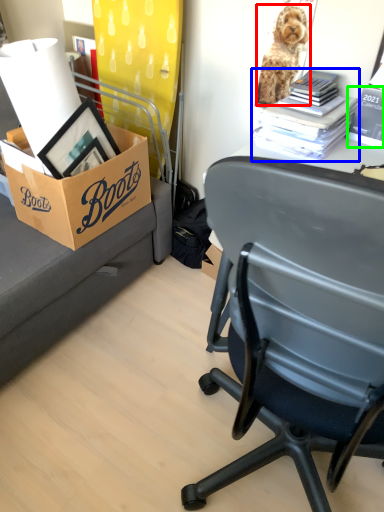
Question: Which object is the farthest from dog (highlighted by a red box)? Choose among these: book (highlighted by a blue box) or book (highlighted by a green box).

Choices:
 (A) book
 (B) book

Answer: (B)